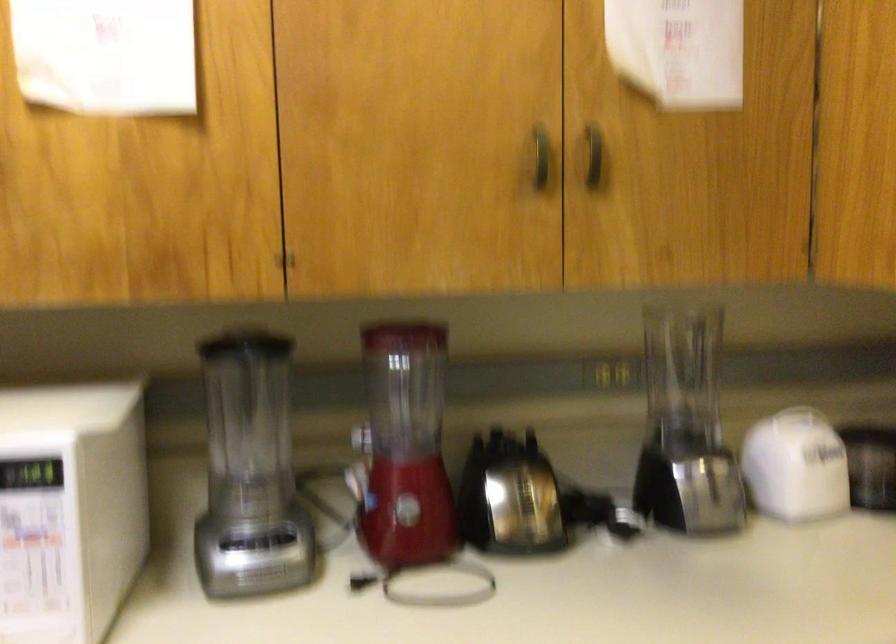
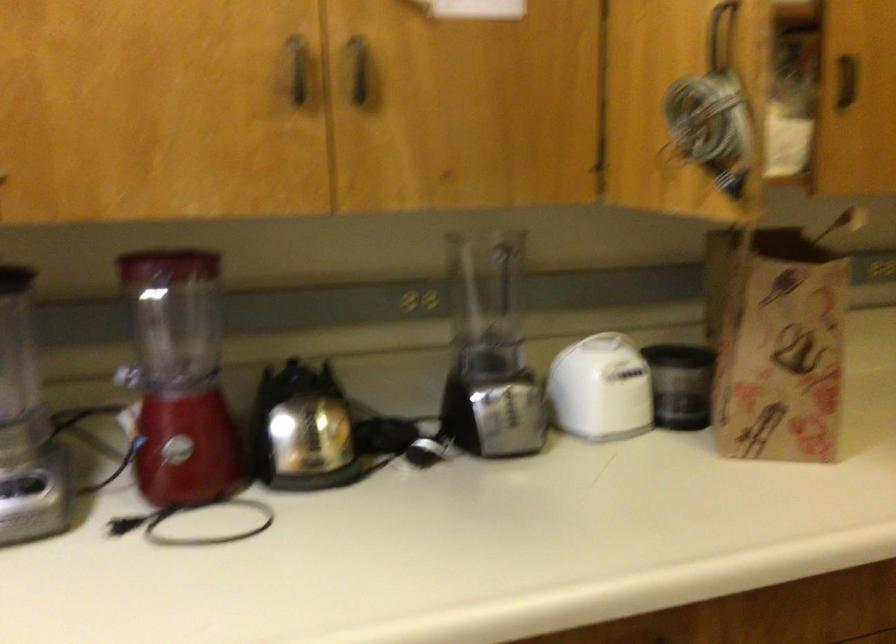
Locate, in the second image, the point that corresponds to [803,468] in the first image.

(600, 389)